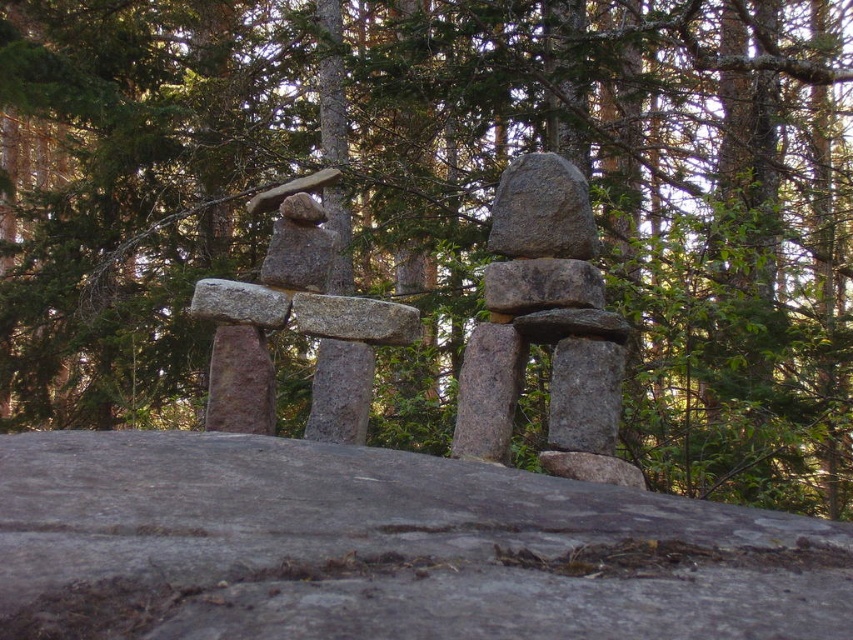
You are a geologist examining the two rock formations in the forest scene. You notice the gray granite rock at center and the gray rough stone at center. Which one has a greater height?

The gray granite rock at center is taller than the gray rough stone at center.

Looking at this image, you are a geologist examining the forest scene. You need to locate the gray granite rock at center for your study. According to the coordinates provided, where exactly would you find it?

The gray granite rock at center is located at point coordinates of (543,211).